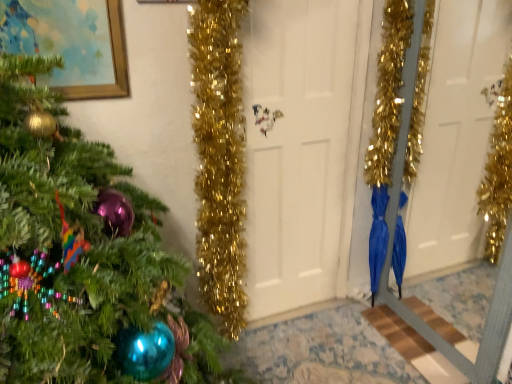
Describe the element at coordinates (85, 258) in the screenshot. I see `green matte christmas tree at left` at that location.

Measure the distance between point (340, 267) and camera.

Point (340, 267) and camera are 2.36 meters apart.

The height and width of the screenshot is (384, 512). Identify the location of green matte christmas tree at left. (85, 258).

Based on the photo, how different are the orientations of blue glossy umbrella at lower right and white matte door at center in degrees?

There is a 90.9-degree angle between the facing directions of blue glossy umbrella at lower right and white matte door at center.

Is white matte door at center at the back of blue glossy umbrella at lower right?

That's not correct — blue glossy umbrella at lower right is not looking away from white matte door at center.

Between blue glossy umbrella at lower right and white matte door at center, which one has smaller width?

white matte door at center is thinner.

Would you say blue glossy umbrella at lower right is inside or outside white matte door at center?

blue glossy umbrella at lower right is spatially situated outside white matte door at center.

This screenshot has height=384, width=512. Find the location of `christmas tree in front of the white matte door at center`. christmas tree in front of the white matte door at center is located at coordinates (85, 258).

Does white matte door at center have a larger size compared to green matte christmas tree at left?

Actually, white matte door at center might be smaller than green matte christmas tree at left.

Between white matte door at center and green matte christmas tree at left, which one appears on the left side from the viewer's perspective?

Positioned to the left is green matte christmas tree at left.

Can you confirm if green matte christmas tree at left is positioned to the left of blue glossy umbrella at lower right?

Yes, green matte christmas tree at left is to the left of blue glossy umbrella at lower right.

How many degrees apart are the facing directions of green matte christmas tree at left and blue glossy umbrella at lower right?

There is a 91.4-degree angle between the facing directions of green matte christmas tree at left and blue glossy umbrella at lower right.

From the image's perspective, is green matte christmas tree at left over blue glossy umbrella at lower right?

Yes.

From the image's perspective, which object appears higher, blue glossy umbrella at lower right or green matte christmas tree at left?

From the image's view, green matte christmas tree at left is above.

Based on the photo, does blue glossy umbrella at lower right have a greater height compared to green matte christmas tree at left?

In fact, blue glossy umbrella at lower right may be shorter than green matte christmas tree at left.

In the scene shown: Looking at their sizes, would you say blue glossy umbrella at lower right is wider or thinner than green matte christmas tree at left?

blue glossy umbrella at lower right is thinner than green matte christmas tree at left.

Is blue glossy umbrella at lower right oriented away from green matte christmas tree at left?

No, blue glossy umbrella at lower right is not facing away from green matte christmas tree at left.

Which is closer, (303, 143) or (376, 260)?

Point (303, 143) is closer to the camera than point (376, 260).

Does white matte door at center have a larger size compared to blue glossy umbrella at lower right?

Indeed, white matte door at center has a larger size compared to blue glossy umbrella at lower right.

Relative to blue glossy umbrella at lower right, is white matte door at center in front or behind?

white matte door at center is positioned closer to the viewer than blue glossy umbrella at lower right.

Can you confirm if white matte door at center is positioned to the right of blue glossy umbrella at lower right?

In fact, white matte door at center is to the left of blue glossy umbrella at lower right.

Consider the image. Which is less distant, (383, 188) or (86, 80)?

Point (383, 188) is farther from the camera than point (86, 80).

From the image's perspective, is blue glossy umbrella at lower right above or below gold-framed painting at upper left?

blue glossy umbrella at lower right is below gold-framed painting at upper left.

Is blue glossy umbrella at lower right positioned in front of gold-framed painting at upper left?

No, blue glossy umbrella at lower right is behind gold-framed painting at upper left.

Is gold-framed painting at upper left inside blue glossy umbrella at lower right?

No, blue glossy umbrella at lower right does not contain gold-framed painting at upper left.

Which of these two, gold-framed painting at upper left or blue glossy umbrella at lower right, stands taller?

blue glossy umbrella at lower right.

Is gold-framed painting at upper left looking in the opposite direction of blue glossy umbrella at lower right?

gold-framed painting at upper left is not turned away from blue glossy umbrella at lower right.

Find the location of a particular element. robe that appears on the right of white matte door at center is located at coordinates (378, 236).

Identify the location of christmas tree below the white matte door at center (from the image's perspective). The height and width of the screenshot is (384, 512). (85, 258).

Estimate the real-world distances between objects in this image. Which object is closer to green matte christmas tree at left, gold-framed painting at upper left or blue glossy umbrella at lower right?

gold-framed painting at upper left is positioned closer to the anchor green matte christmas tree at left.

From the image, which object appears to be nearer to green matte christmas tree at left, blue glossy umbrella at lower right or gold-framed painting at upper left?

gold-framed painting at upper left is positioned closer to the anchor green matte christmas tree at left.

Estimate the real-world distances between objects in this image. Which object is further from green matte christmas tree at left, gold-framed painting at upper left or white matte door at center?

white matte door at center.

When comparing their distances from blue glossy umbrella at lower right, does green matte christmas tree at left or gold-framed painting at upper left seem further?

gold-framed painting at upper left is further to blue glossy umbrella at lower right.

Estimate the real-world distances between objects in this image. Which object is further from gold-framed painting at upper left, blue glossy umbrella at lower right or green matte christmas tree at left?

The object further to gold-framed painting at upper left is blue glossy umbrella at lower right.

Looking at the image, which one is located closer to white matte door at center, blue glossy umbrella at lower right or green matte christmas tree at left?

The object closer to white matte door at center is blue glossy umbrella at lower right.

When comparing their distances from blue glossy umbrella at lower right, does gold-framed painting at upper left or white matte door at center seem closer?

white matte door at center.

Consider the image. From the image, which object appears to be farther from gold-framed painting at upper left, green matte christmas tree at left or blue glossy umbrella at lower right?

blue glossy umbrella at lower right is further to gold-framed painting at upper left.

Image resolution: width=512 pixels, height=384 pixels. I want to click on door between green matte christmas tree at left and blue glossy umbrella at lower right in the front-back direction, so click(x=302, y=147).

I want to click on christmas tree situated between gold-framed painting at upper left and blue glossy umbrella at lower right from left to right, so click(85, 258).

Where is `door between gold-framed painting at upper left and blue glossy umbrella at lower right`? The image size is (512, 384). door between gold-framed painting at upper left and blue glossy umbrella at lower right is located at coordinates (302, 147).

Locate an element on the screen. The image size is (512, 384). christmas tree between gold-framed painting at upper left and white matte door at center in the horizontal direction is located at coordinates (85, 258).